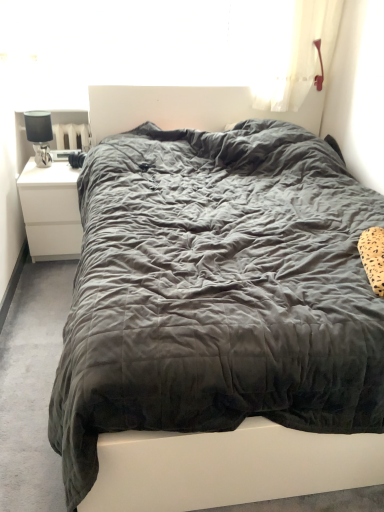
Identify the location of vacant point above white matte nightstand at left (from a real-world perspective). The image size is (384, 512). (57, 161).